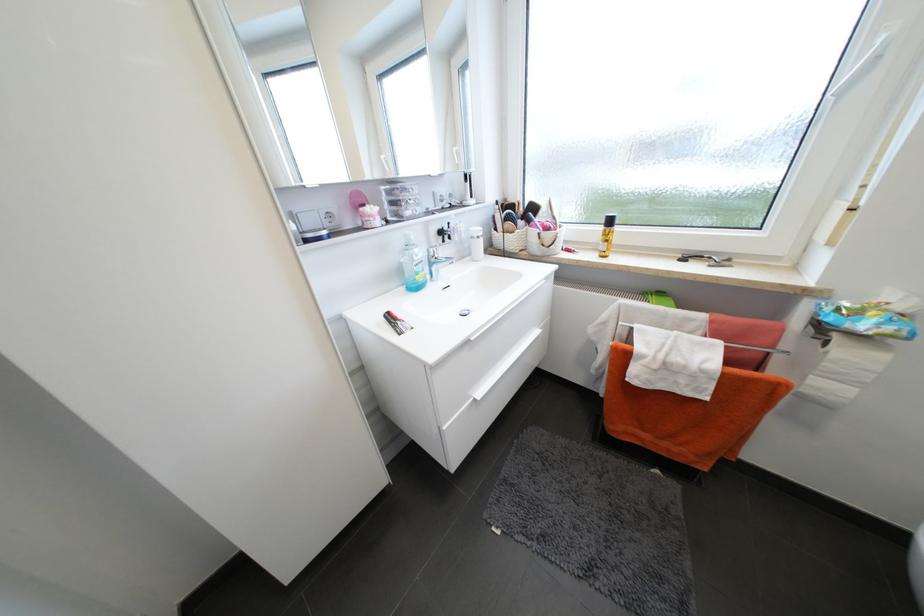
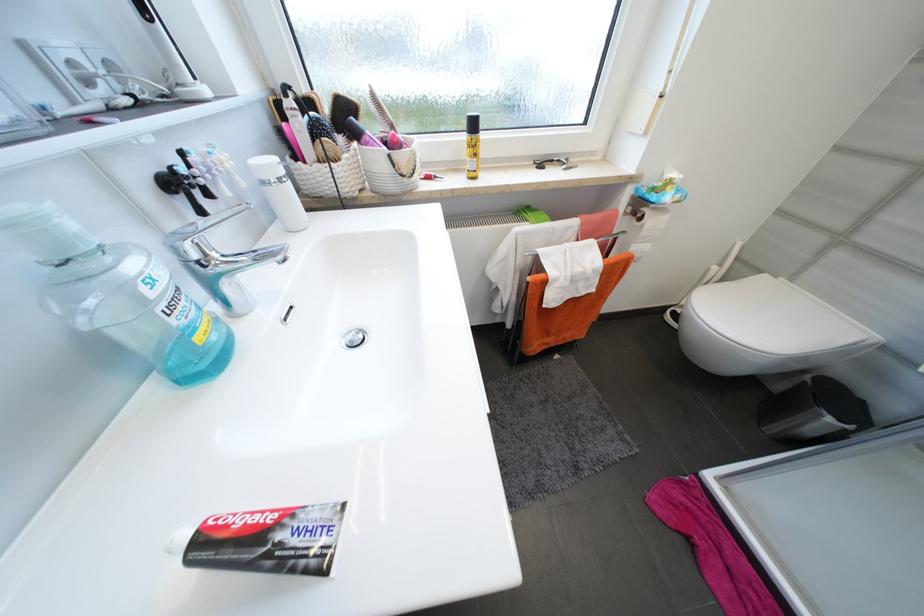
Locate, in the second image, the point that corresponds to point (419, 238) in the first image.

(78, 227)